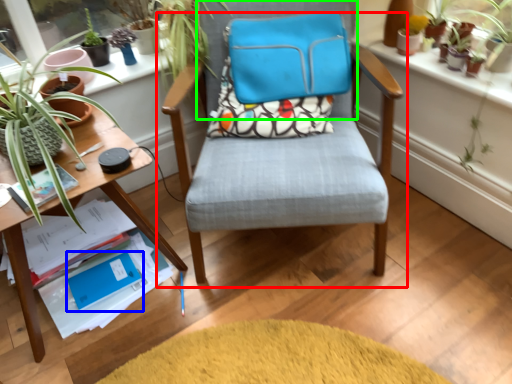
Question: Based on their relative distances, which object is farther from chair (highlighted by a red box)? Choose from paperback book (highlighted by a blue box) and chair (highlighted by a green box).

Choices:
 (A) paperback book
 (B) chair

Answer: (A)